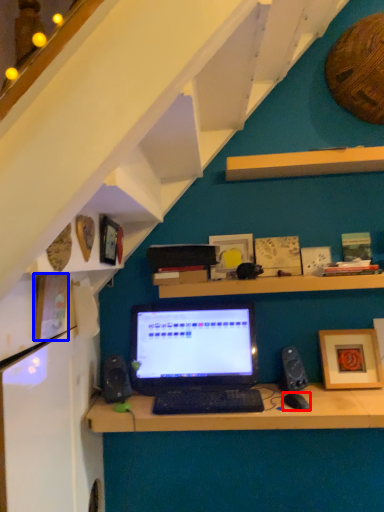
Question: Which point is closer to the camera, computer mouse (highlighted by a red box) or picture frame (highlighted by a blue box)?

Choices:
 (A) computer mouse
 (B) picture frame

Answer: (B)